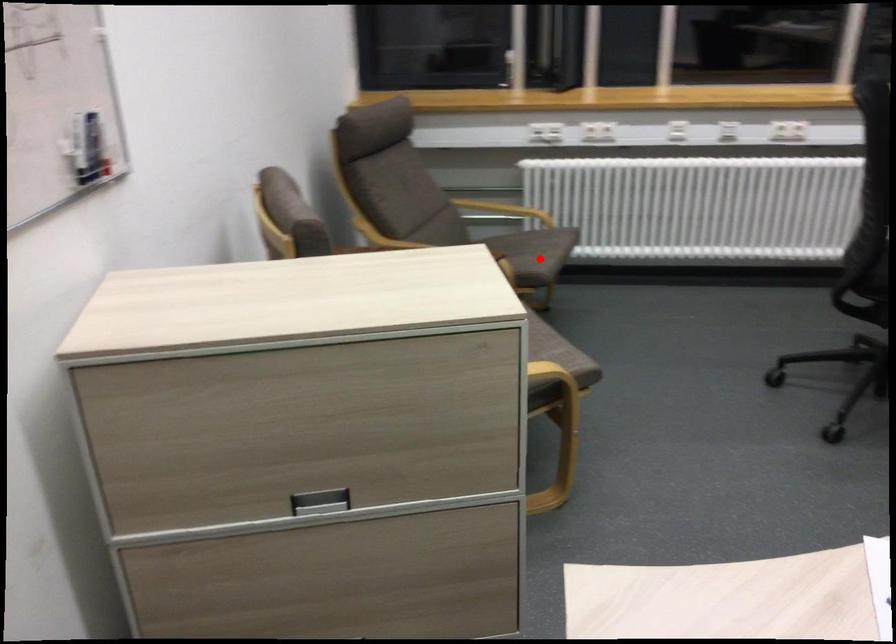
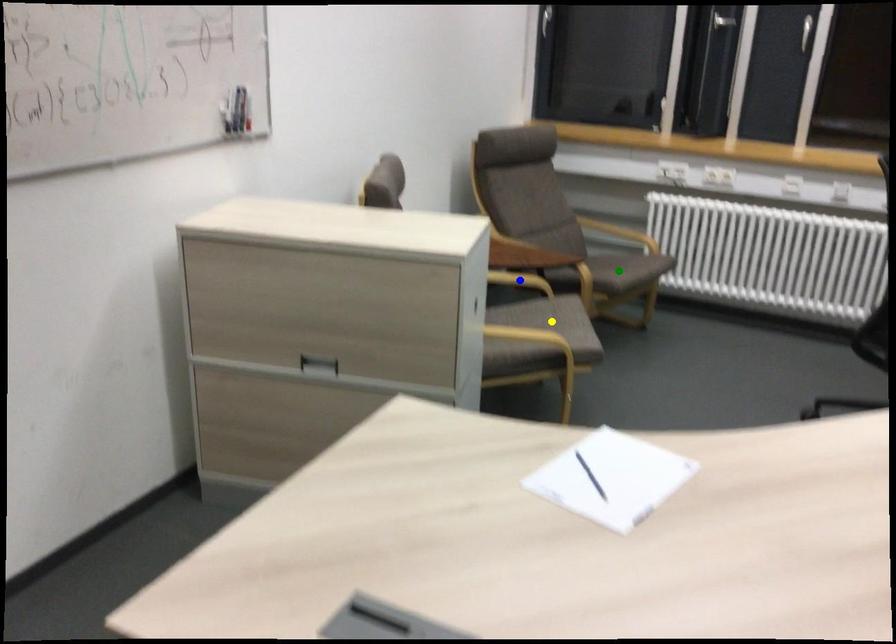
Question: I am providing you with two images of the same scene from different viewpoints. A red point is marked on the first image. You are given multiple points on the second image. In image 2, which mark is for the same physical point as the one in image 1?

Choices:
 (A) green point
 (B) yellow point
 (C) blue point

Answer: (A)